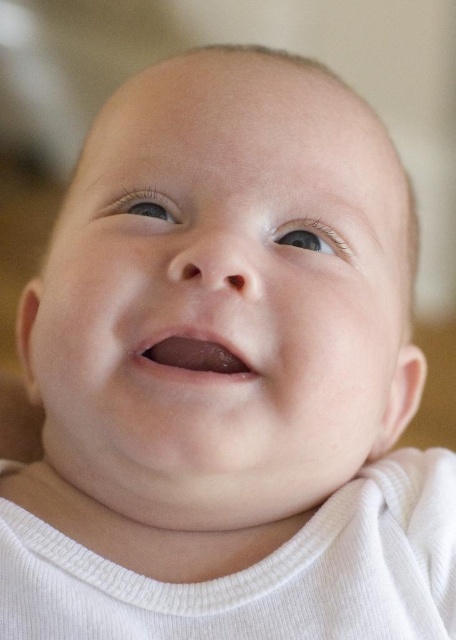
Question: Can you confirm if smooth pink lips at center is wider than blue smooth eye at upper center?

Choices:
 (A) yes
 (B) no

Answer: (A)

Question: Which object is closer to the camera taking this photo?

Choices:
 (A) smooth pink lips at center
 (B) blue smooth eye at upper center

Answer: (A)

Question: Is white ribbed fabric at center positioned at the back of blue glossy eye at upper left?

Choices:
 (A) no
 (B) yes

Answer: (A)

Question: Which point appears closest to the camera in this image?

Choices:
 (A) (210, 337)
 (B) (305, 244)
 (C) (58, 566)

Answer: (A)

Question: Can you confirm if white ribbed fabric at center is positioned above blue glossy eye at upper left?

Choices:
 (A) yes
 (B) no

Answer: (B)

Question: Based on their relative distances, which object is farther from the blue smooth eye at upper center?

Choices:
 (A) white ribbed fabric at center
 (B) blue glossy eye at upper left

Answer: (A)